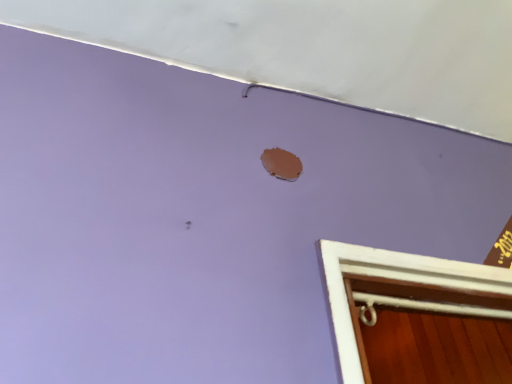
Question: Considering the relative sizes of matte white exhaust hood at upper center and matte brown hole at upper center in the image provided, is matte white exhaust hood at upper center bigger than matte brown hole at upper center?

Choices:
 (A) no
 (B) yes

Answer: (B)

Question: From a real-world perspective, is matte white exhaust hood at upper center located beneath matte brown hole at upper center?

Choices:
 (A) no
 (B) yes

Answer: (A)

Question: From the image's perspective, is matte white exhaust hood at upper center under matte brown hole at upper center?

Choices:
 (A) yes
 (B) no

Answer: (B)

Question: Is matte white exhaust hood at upper center closer to the viewer compared to matte brown hole at upper center?

Choices:
 (A) yes
 (B) no

Answer: (A)

Question: Is matte white exhaust hood at upper center not close to matte brown hole at upper center?

Choices:
 (A) no
 (B) yes

Answer: (A)

Question: Does matte white exhaust hood at upper center have a greater width compared to matte brown hole at upper center?

Choices:
 (A) yes
 (B) no

Answer: (A)

Question: Is matte brown hole at upper center touching matte white exhaust hood at upper center?

Choices:
 (A) yes
 (B) no

Answer: (B)

Question: Is matte brown hole at upper center far away from matte white exhaust hood at upper center?

Choices:
 (A) no
 (B) yes

Answer: (A)

Question: From a real-world perspective, is matte brown hole at upper center located higher than matte white exhaust hood at upper center?

Choices:
 (A) yes
 (B) no

Answer: (B)

Question: Considering the relative sizes of matte brown hole at upper center and matte white exhaust hood at upper center in the image provided, is matte brown hole at upper center thinner than matte white exhaust hood at upper center?

Choices:
 (A) yes
 (B) no

Answer: (A)

Question: Considering the relative sizes of matte brown hole at upper center and matte white exhaust hood at upper center in the image provided, is matte brown hole at upper center shorter than matte white exhaust hood at upper center?

Choices:
 (A) yes
 (B) no

Answer: (B)

Question: Can you confirm if matte brown hole at upper center is taller than matte white exhaust hood at upper center?

Choices:
 (A) no
 (B) yes

Answer: (B)

Question: Which is correct: matte white exhaust hood at upper center is inside matte brown hole at upper center, or outside of it?

Choices:
 (A) outside
 (B) inside

Answer: (A)